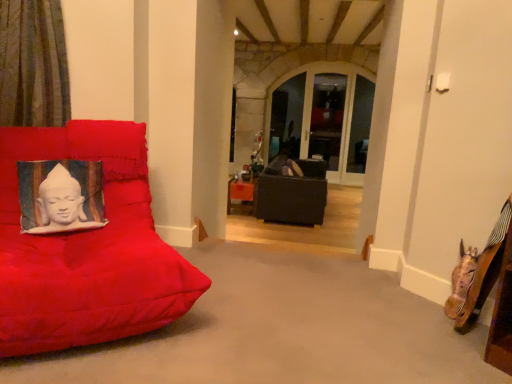
Question: From the image's perspective, is suede red cushion at left, the 2th furniture positioned from the back, under matte black couch at center, marked as the 2th furniture in a left-to-right arrangement?

Choices:
 (A) yes
 (B) no

Answer: (A)

Question: Is suede red cushion at left, which appears as the first furniture when viewed from the left, facing towards matte black couch at center, marked as the 2th furniture in a left-to-right arrangement?

Choices:
 (A) yes
 (B) no

Answer: (B)

Question: Is suede red cushion at left, acting as the 2th furniture starting from the right, looking in the opposite direction of matte black couch at center, acting as the 2th furniture starting from the front?

Choices:
 (A) yes
 (B) no

Answer: (B)

Question: Does suede red cushion at left, the 2th furniture positioned from the back, appear on the right side of matte black couch at center, placed as the first furniture when sorted from back to front?

Choices:
 (A) yes
 (B) no

Answer: (B)

Question: Is suede red cushion at left, acting as the 2th furniture starting from the right, completely or partially outside of matte black couch at center, marked as the 2th furniture in a left-to-right arrangement?

Choices:
 (A) no
 (B) yes

Answer: (B)

Question: Considering the relative positions of silk cushion with buddha print at left and clear glass window at center in the image provided, is silk cushion with buddha print at left to the left or to the right of clear glass window at center?

Choices:
 (A) right
 (B) left

Answer: (B)

Question: From the image's perspective, is silk cushion with buddha print at left above or below clear glass window at center?

Choices:
 (A) above
 (B) below

Answer: (B)

Question: Considering their positions, is silk cushion with buddha print at left located in front of or behind clear glass window at center?

Choices:
 (A) front
 (B) behind

Answer: (A)

Question: Considering the positions of silk cushion with buddha print at left and clear glass window at center in the image, is silk cushion with buddha print at left wider or thinner than clear glass window at center?

Choices:
 (A) wide
 (B) thin

Answer: (A)

Question: In terms of size, does green striped curtain at left appear bigger or smaller than clear glass window at center?

Choices:
 (A) small
 (B) big

Answer: (A)

Question: In terms of width, does green striped curtain at left look wider or thinner when compared to clear glass window at center?

Choices:
 (A) thin
 (B) wide

Answer: (B)

Question: Is point (56, 97) positioned closer to the camera than point (359, 74)?

Choices:
 (A) closer
 (B) farther

Answer: (A)

Question: Do you think green striped curtain at left is within clear glass window at center, or outside of it?

Choices:
 (A) inside
 (B) outside

Answer: (B)

Question: Is suede red cushion at left, acting as the 2th furniture starting from the right, inside the boundaries of clear glass window at center, or outside?

Choices:
 (A) inside
 (B) outside

Answer: (B)

Question: Considering the positions of point (17, 256) and point (267, 135), is point (17, 256) closer or farther from the camera than point (267, 135)?

Choices:
 (A) farther
 (B) closer

Answer: (B)